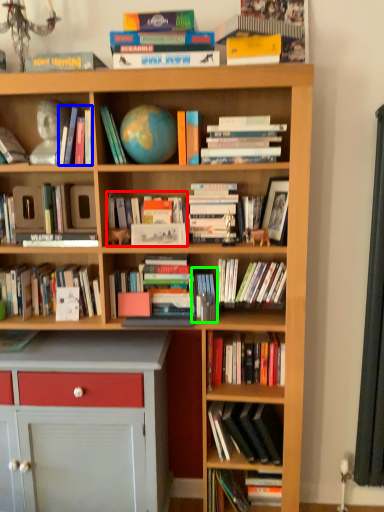
Question: Which object is positioned closest to book (highlighted by a red box)? Select from book (highlighted by a blue box) and book (highlighted by a green box).

Choices:
 (A) book
 (B) book

Answer: (B)